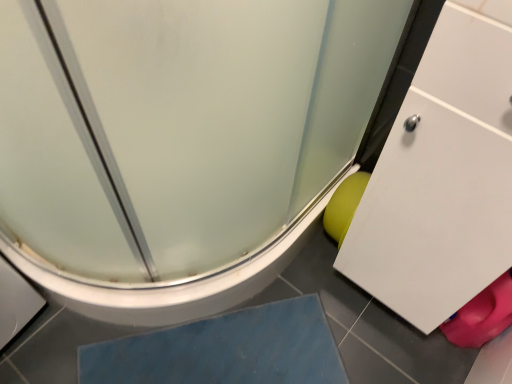
What is the approximate height of blue rubber mat at lower center?

blue rubber mat at lower center is 1.56 inches tall.

The width and height of the screenshot is (512, 384). In order to click on blue rubber mat at lower center in this screenshot , I will do `click(225, 350)`.

This screenshot has width=512, height=384. Describe the element at coordinates (225, 350) in the screenshot. I see `blue rubber mat at lower center` at that location.

Locate an element on the screen. frosted glass shower door at lower right is located at coordinates 179,127.

What do you see at coordinates (179, 127) in the screenshot?
I see `frosted glass shower door at lower right` at bounding box center [179, 127].

What is the approximate width of frosted glass shower door at lower right?

It is 37.04 inches.

Locate an element on the screen. Image resolution: width=512 pixels, height=384 pixels. blue rubber mat at lower center is located at coordinates (225, 350).

Considering the relative positions of blue rubber mat at lower center and frosted glass shower door at lower right in the image provided, is blue rubber mat at lower center to the left of frosted glass shower door at lower right from the viewer's perspective?

Incorrect, blue rubber mat at lower center is not on the left side of frosted glass shower door at lower right.

In the scene shown: Which object is further away from the camera, blue rubber mat at lower center or frosted glass shower door at lower right?

blue rubber mat at lower center is further from the camera.

Which is in front, point (313, 320) or point (247, 75)?

The point (247, 75) is more forward.

From the image's perspective, between blue rubber mat at lower center and frosted glass shower door at lower right, which one is located above?

frosted glass shower door at lower right is shown above in the image.

From a real-world perspective, which object stands above the other?

frosted glass shower door at lower right is physically above.

Does blue rubber mat at lower center have a lesser width compared to frosted glass shower door at lower right?

Yes, blue rubber mat at lower center is thinner than frosted glass shower door at lower right.

Considering the relative sizes of blue rubber mat at lower center and frosted glass shower door at lower right in the image provided, is blue rubber mat at lower center taller than frosted glass shower door at lower right?

In fact, blue rubber mat at lower center may be shorter than frosted glass shower door at lower right.

Does blue rubber mat at lower center have a smaller size compared to frosted glass shower door at lower right?

Yes.

Is frosted glass shower door at lower right surrounded by blue rubber mat at lower center?

No, frosted glass shower door at lower right is located outside of blue rubber mat at lower center.

Is blue rubber mat at lower center directly adjacent to frosted glass shower door at lower right?

No, blue rubber mat at lower center is not next to frosted glass shower door at lower right.

Could you tell me if blue rubber mat at lower center is turned towards frosted glass shower door at lower right?

No, blue rubber mat at lower center is not aimed at frosted glass shower door at lower right.

Can you tell me how much blue rubber mat at lower center and frosted glass shower door at lower right differ in facing direction?

The angular difference between blue rubber mat at lower center and frosted glass shower door at lower right is 37.2 degrees.

Identify the location of screen door that is above the blue rubber mat at lower center (from a real-world perspective). This screenshot has width=512, height=384. [179, 127].

Which is more to the right, frosted glass shower door at lower right or blue rubber mat at lower center?

From the viewer's perspective, blue rubber mat at lower center appears more on the right side.

Considering the positions of objects frosted glass shower door at lower right and blue rubber mat at lower center in the image provided, who is in front, frosted glass shower door at lower right or blue rubber mat at lower center?

frosted glass shower door at lower right is more forward.

Considering the points (165, 41) and (239, 353), which point is in front, point (165, 41) or point (239, 353)?

Point (165, 41)

From the image's perspective, which one is positioned higher, frosted glass shower door at lower right or blue rubber mat at lower center?

From the image's view, frosted glass shower door at lower right is above.

From a real-world perspective, does frosted glass shower door at lower right stand above blue rubber mat at lower center?

Yes.

Does frosted glass shower door at lower right have a greater width compared to blue rubber mat at lower center?

Yes, frosted glass shower door at lower right is wider than blue rubber mat at lower center.

Considering the sizes of objects frosted glass shower door at lower right and blue rubber mat at lower center in the image provided, who is shorter, frosted glass shower door at lower right or blue rubber mat at lower center?

blue rubber mat at lower center is shorter.

Considering the relative sizes of frosted glass shower door at lower right and blue rubber mat at lower center in the image provided, is frosted glass shower door at lower right bigger than blue rubber mat at lower center?

Correct, frosted glass shower door at lower right is larger in size than blue rubber mat at lower center.

Would you say frosted glass shower door at lower right is outside blue rubber mat at lower center?

Yes, frosted glass shower door at lower right is outside of blue rubber mat at lower center.

Are frosted glass shower door at lower right and blue rubber mat at lower center beside each other?

No, frosted glass shower door at lower right is not in contact with blue rubber mat at lower center.

Is frosted glass shower door at lower right looking in the opposite direction of blue rubber mat at lower center?

No, frosted glass shower door at lower right is not facing the opposite direction of blue rubber mat at lower center.

How many degrees apart are the facing directions of frosted glass shower door at lower right and blue rubber mat at lower center?

The facing directions of frosted glass shower door at lower right and blue rubber mat at lower center are 37.2 degrees apart.

There is a blue rubber mat at lower center. At what (x,y) coordinates should I click in order to perform the action: click on screen door above it (from a real-world perspective). Please return your answer as a coordinate pair (x, y). This screenshot has height=384, width=512. Looking at the image, I should click on (179, 127).

Locate an element on the screen. The width and height of the screenshot is (512, 384). screen door that is on the left side of blue rubber mat at lower center is located at coordinates click(x=179, y=127).

Where is `screen door located above the blue rubber mat at lower center (from the image's perspective)`? This screenshot has width=512, height=384. screen door located above the blue rubber mat at lower center (from the image's perspective) is located at coordinates (179, 127).